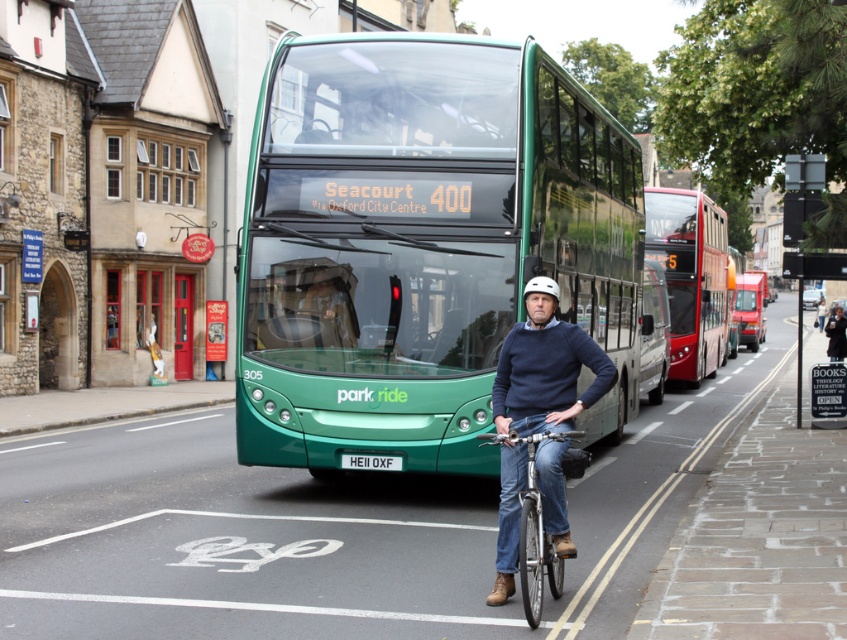
Based on the photo, you are a delivery person who needs to load a tall package onto your van. The package is 2 meters tall. You see the green metallic bus at center and the metallic silver bicycle at center in the street. Which object is taller and can the package fit under it?

The green metallic bus at center is taller than the metallic silver bicycle at center. Since the package is 2 meters tall, it can fit under the green metallic bus at center as long as the bus is at least 2 meters tall. However, without knowing the exact height of the bus, we cannot confirm if the package will fit. Alternatively, the metallic silver bicycle at center is shorter, so the package cannot fit under it.

You are a pedestrian standing near the bike lane. You see the red metallic bus at right and the white plastic license plate at center. Which object is closer to your right side?

The red metallic bus at right is closer to your right side because it is positioned to the right of the white plastic license plate at center.

You are a pedestrian standing at the crosswalk and see the denim jeans at center and the white plastic license plate at center. Which object is higher from the ground?

The denim jeans at center is above the white plastic license plate at center, so the denim jeans at center is higher from the ground.